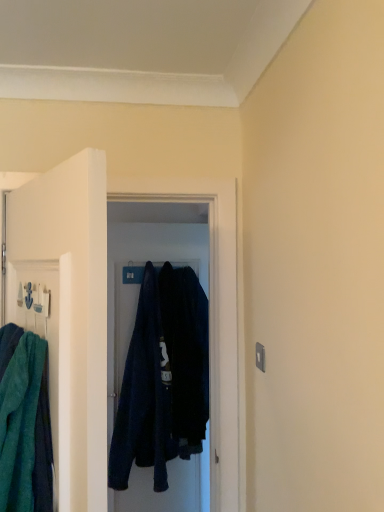
What do you see at coordinates (70, 310) in the screenshot?
I see `teal towel at left` at bounding box center [70, 310].

This screenshot has height=512, width=384. Describe the element at coordinates (144, 397) in the screenshot. I see `dark blue fabric robe at center` at that location.

Find the location of a particular element. teal towel at left is located at coordinates (70, 310).

From the image's perspective, which object appears higher, dark blue fabric robe at center or dark blue fabric at center?

dark blue fabric robe at center is shown above in the image.

Does dark blue fabric robe at center have a smaller size compared to dark blue fabric at center?

Indeed, dark blue fabric robe at center has a smaller size compared to dark blue fabric at center.

Can dark blue fabric at center be found inside dark blue fabric robe at center?

No, dark blue fabric robe at center does not contain dark blue fabric at center.

Can you confirm if dark blue fabric robe at center is taller than dark blue fabric at center?

In fact, dark blue fabric robe at center may be shorter than dark blue fabric at center.

Could dark blue fabric robe at center be considered to be inside dark blue fabric at center?

No, dark blue fabric robe at center is not a part of dark blue fabric at center.

Can you confirm if dark blue fabric at center is thinner than dark blue fabric robe at center?

Indeed, dark blue fabric at center has a lesser width compared to dark blue fabric robe at center.

Is dark blue fabric at center not close to dark blue fabric robe at center?

No, dark blue fabric at center is not far from dark blue fabric robe at center.

Is point (145, 497) positioned after point (135, 395)?

That is True.

Consider the image. Between dark blue fabric at center and teal towel at left, which one has smaller width?

Thinner between the two is dark blue fabric at center.

Is dark blue fabric at center smaller than teal towel at left?

No.

Which object is closer to the camera taking this photo, dark blue fabric at center or teal towel at left?

teal towel at left is in front.

Would you say dark blue fabric at center is a long distance from teal towel at left?

Yes, dark blue fabric at center and teal towel at left are located far from each other.

Considering the points (133, 436) and (88, 326), which point is in front, point (133, 436) or point (88, 326)?

The point (88, 326) is more forward.

Can we say dark blue fabric robe at center lies outside teal towel at left?

Absolutely, dark blue fabric robe at center is external to teal towel at left.

Is dark blue fabric robe at center shorter than teal towel at left?

No, dark blue fabric robe at center is not shorter than teal towel at left.

How many degrees apart are the facing directions of teal towel at left and dark blue fabric robe at center?

They differ by 75 degrees in their facing directions.

From a real-world perspective, does teal towel at left stand above dark blue fabric robe at center?

Yes, from a real-world perspective, teal towel at left is above dark blue fabric robe at center.

Identify the location of door positioned vertically above the dark blue fabric robe at center (from a real-world perspective). (70, 310).

Is teal towel at left beside dark blue fabric robe at center?

No, teal towel at left is not making contact with dark blue fabric robe at center.

Is point (10, 306) in front of point (177, 506)?

Yes.

In the scene shown: Is teal towel at left looking in the opposite direction of dark blue fabric at center?

teal towel at left is not turned away from dark blue fabric at center.

From a real-world perspective, which object rests below the other?

dark blue fabric at center, from a real-world perspective.

Measure the distance between teal towel at left and dark blue fabric at center.

teal towel at left and dark blue fabric at center are 4.10 feet apart.

At what (x,y) coordinates should I click in order to perform the action: click on robe above the dark blue fabric at center (from the image's perspective). Please return your answer as a coordinate pair (x, y). Looking at the image, I should click on (144, 397).

At what (x,y) coordinates should I click in order to perform the action: click on robe on the left side of dark blue fabric at center. Please return your answer as a coordinate pair (x, y). The width and height of the screenshot is (384, 512). Looking at the image, I should click on (144, 397).

Estimate the real-world distances between objects in this image. Which object is closer to dark blue fabric at center, teal towel at left or dark blue fabric robe at center?

dark blue fabric robe at center is positioned closer to the anchor dark blue fabric at center.

Consider the image. Estimate the real-world distances between objects in this image. Which object is closer to dark blue fabric at center, dark blue fabric robe at center or teal towel at left?

dark blue fabric robe at center is closer to dark blue fabric at center.

Consider the image. From the image, which object appears to be farther from teal towel at left, dark blue fabric robe at center or dark blue fabric at center?

dark blue fabric robe at center lies further to teal towel at left than the other object.

Which object lies nearer to the anchor point dark blue fabric robe at center, teal towel at left or dark blue fabric at center?

dark blue fabric at center is positioned closer to the anchor dark blue fabric robe at center.

Based on their spatial positions, is dark blue fabric at center or dark blue fabric robe at center further from teal towel at left?

The object further to teal towel at left is dark blue fabric robe at center.

Based on their spatial positions, is dark blue fabric at center or teal towel at left further from dark blue fabric robe at center?

teal towel at left.

This screenshot has height=512, width=384. I want to click on robe located between teal towel at left and dark blue fabric at center in the depth direction, so click(x=144, y=397).